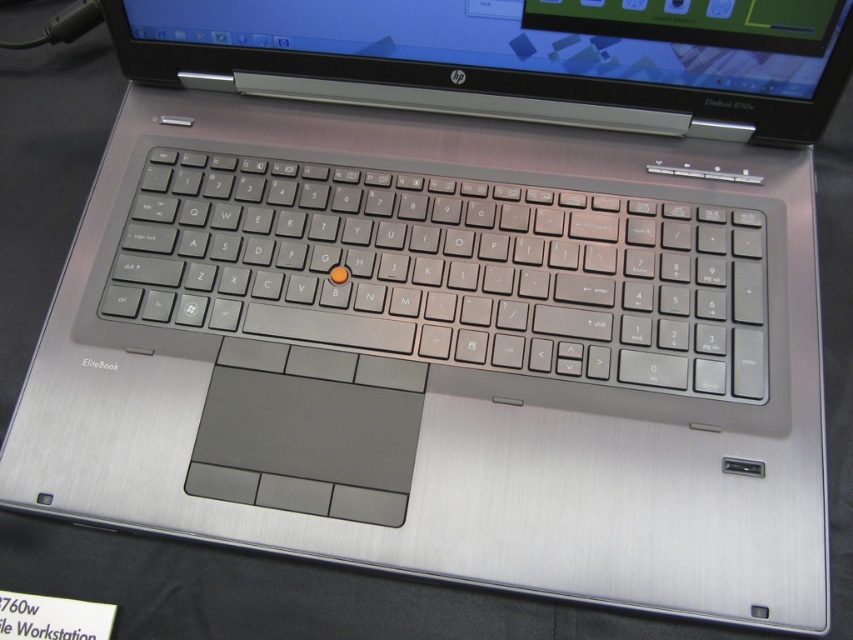
Is point (328, 240) in front of point (239, 22)?

Yes.

Is satin silver keyboard at center taller than brushed metal laptop at upper center?

Yes, satin silver keyboard at center is taller than brushed metal laptop at upper center.

Who is more distant from viewer, (222, 252) or (219, 29)?

Point (219, 29)

The width and height of the screenshot is (853, 640). I want to click on satin silver keyboard at center, so click(444, 273).